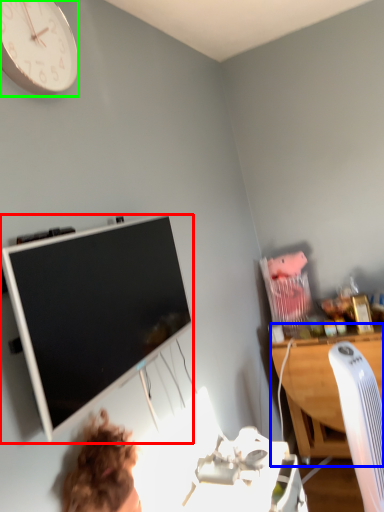
Question: Estimate the real-world distances between objects in this image. Which object is farther from television (highlighted by a red box), desk (highlighted by a blue box) or wall clock (highlighted by a green box)?

Choices:
 (A) desk
 (B) wall clock

Answer: (A)